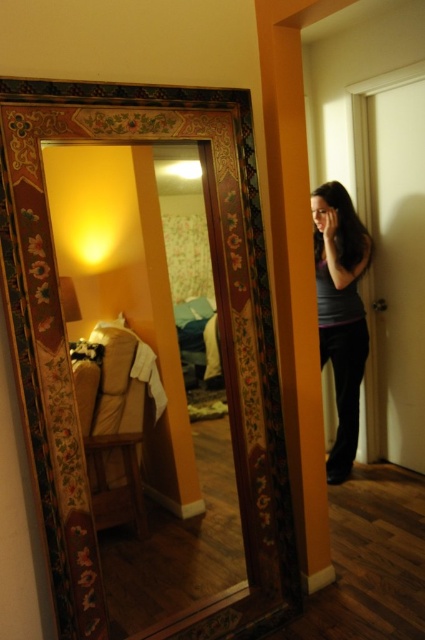
Can you confirm if wooden mirror at center is thinner than matte gray shirt at right?

No.

At what (x,y) coordinates should I click in order to perform the action: click on wooden mirror at center. Please return your answer as a coordinate pair (x, y). Looking at the image, I should click on (147, 364).